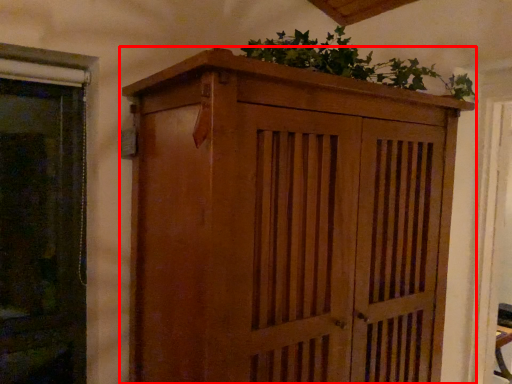
Question: From the image's perspective, what is the correct spatial relationship of cupboard (annotated by the red box) in relation to houseplant?

Choices:
 (A) above
 (B) below

Answer: (B)